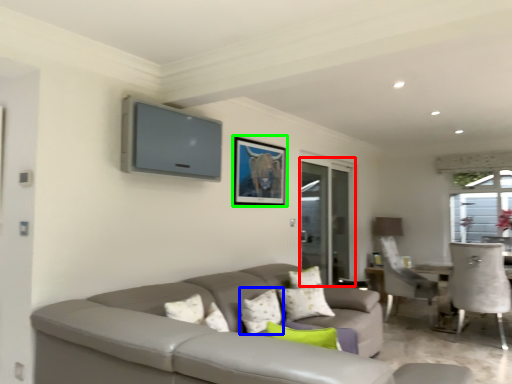
Question: Which object is the farthest from screen door (highlighted by a red box)? Choose among these: pillow (highlighted by a blue box) or picture frame (highlighted by a green box).

Choices:
 (A) pillow
 (B) picture frame

Answer: (A)